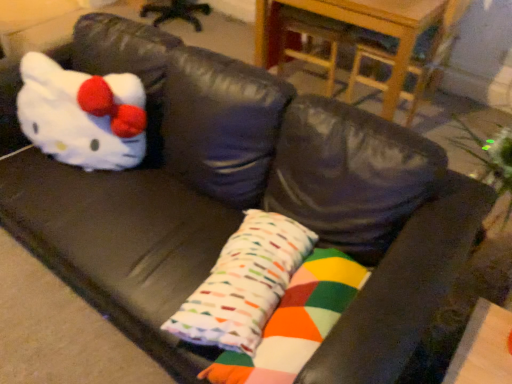
Question: Considering the positions of white plush toy at left and multicolored fabric pillow at center in the image, is white plush toy at left taller or shorter than multicolored fabric pillow at center?

Choices:
 (A) short
 (B) tall

Answer: (B)

Question: From a real-world perspective, is white plush toy at left positioned above or below multicolored fabric pillow at center?

Choices:
 (A) above
 (B) below

Answer: (A)

Question: Which object is positioned farthest from the white plush toy at left?

Choices:
 (A) multicolored fabric pillow at center
 (B) multicolored fabric pillow at center
 (C) wooden table at upper center

Answer: (C)

Question: Estimate the real-world distances between objects in this image. Which object is closer to the white plush toy at left?

Choices:
 (A) multicolored fabric pillow at center
 (B) multicolored fabric pillow at center
 (C) wooden table at upper center

Answer: (A)